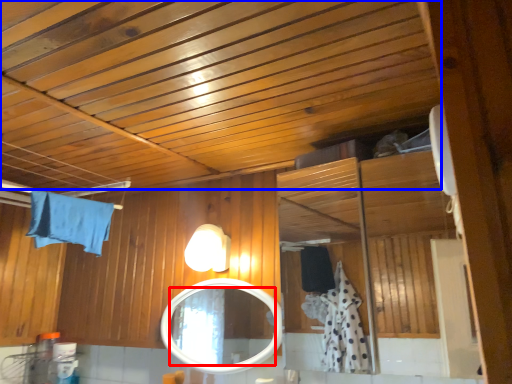
Question: Which object appears closest to the camera in this image, mirror (highlighted by a red box) or exhaust hood (highlighted by a blue box)?

Choices:
 (A) mirror
 (B) exhaust hood

Answer: (B)